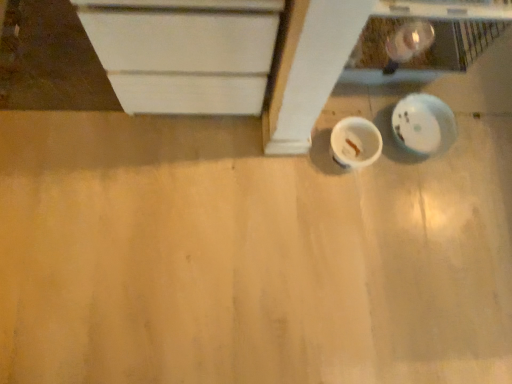
Image resolution: width=512 pixels, height=384 pixels. Identify the location of vacant space underneath white matte cup at center (from a real-world perspective). (348, 158).